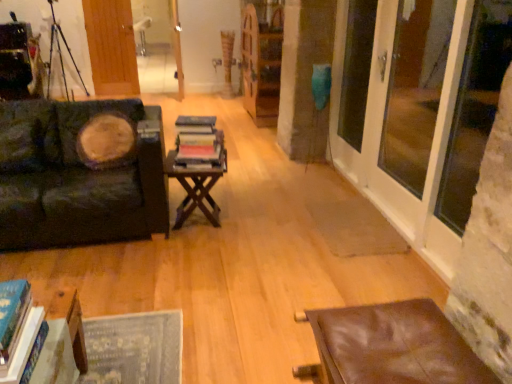
Question: Is transparent glass door at right, marked as the 3th window screen in a back-to-front arrangement, not near transparent glass door at right, the 2th window screen positioned from the front?

Choices:
 (A) yes
 (B) no

Answer: (B)

Question: Does transparent glass door at right, marked as the 3th window screen in a back-to-front arrangement, come behind transparent glass door at right, the 2th window screen positioned from the front?

Choices:
 (A) no
 (B) yes

Answer: (A)

Question: Is transparent glass door at right, which is the first window screen from front to back, not within transparent glass door at right, the 2th window screen positioned from the back?

Choices:
 (A) no
 (B) yes

Answer: (B)

Question: Does transparent glass door at right, which is the first window screen from front to back, have a lesser width compared to transparent glass door at right, the 2th window screen positioned from the back?

Choices:
 (A) no
 (B) yes

Answer: (B)

Question: From the image's perspective, is transparent glass door at right, which is the first window screen from front to back, beneath transparent glass door at right, the 2th window screen positioned from the front?

Choices:
 (A) yes
 (B) no

Answer: (A)

Question: Is wooden table at lower left, the second table positioned from the top, taller or shorter than velvet dark green couch at left?

Choices:
 (A) tall
 (B) short

Answer: (B)

Question: Would you say wooden table at lower left, the 1th table in the front-to-back sequence, is inside or outside velvet dark green couch at left?

Choices:
 (A) inside
 (B) outside

Answer: (B)

Question: Looking at the image, does wooden table at lower left, placed as the third table when sorted from right to left, seem bigger or smaller compared to velvet dark green couch at left?

Choices:
 (A) big
 (B) small

Answer: (B)

Question: Considering the positions of point (75, 347) and point (110, 221), is point (75, 347) closer or farther from the camera than point (110, 221)?

Choices:
 (A) farther
 (B) closer

Answer: (B)

Question: Is hardcover books at center in front of or behind velvet dark green couch at left in the image?

Choices:
 (A) behind
 (B) front

Answer: (A)

Question: Which is correct: hardcover books at center is inside velvet dark green couch at left, or outside of it?

Choices:
 (A) inside
 (B) outside

Answer: (B)

Question: Is point (199, 134) closer or farther from the camera than point (125, 208)?

Choices:
 (A) closer
 (B) farther

Answer: (B)

Question: From the image's perspective, relative to velvet dark green couch at left, is hardcover books at center above or below?

Choices:
 (A) below
 (B) above

Answer: (B)

Question: From the image's perspective, is metallic tripod at upper left located above or below wooden bookcase at center?

Choices:
 (A) above
 (B) below

Answer: (A)

Question: Is point (65, 89) closer or farther from the camera than point (266, 89)?

Choices:
 (A) closer
 (B) farther

Answer: (A)